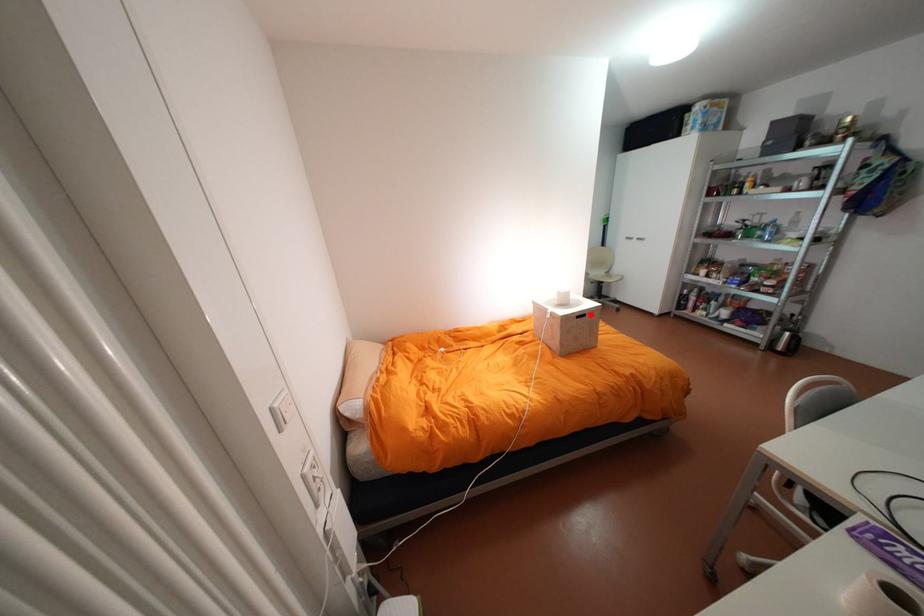
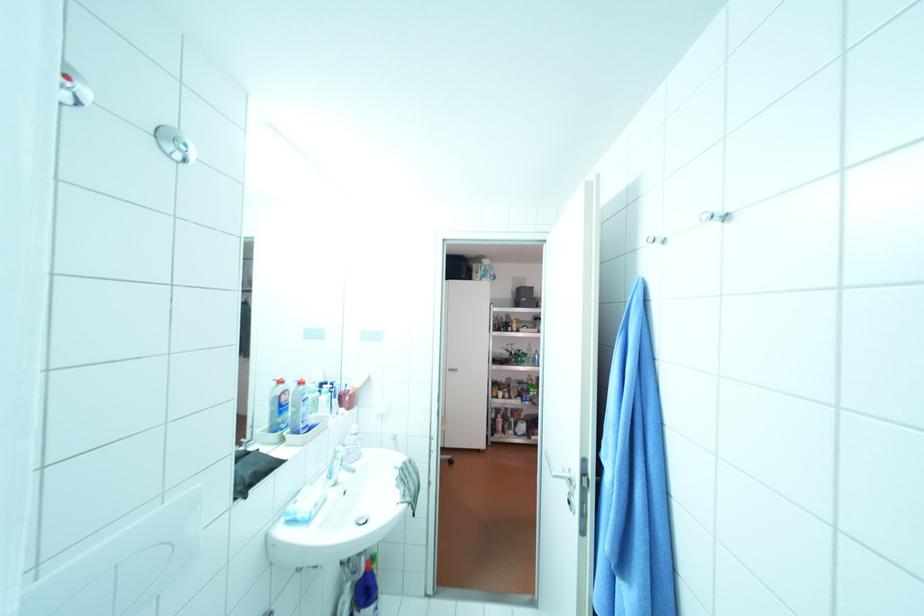
Question: I am providing you with two images of the same scene from different viewpoints. A red point is marked on the first image. Can you still see the location of the red point in image 2?

Choices:
 (A) Yes
 (B) No

Answer: (B)